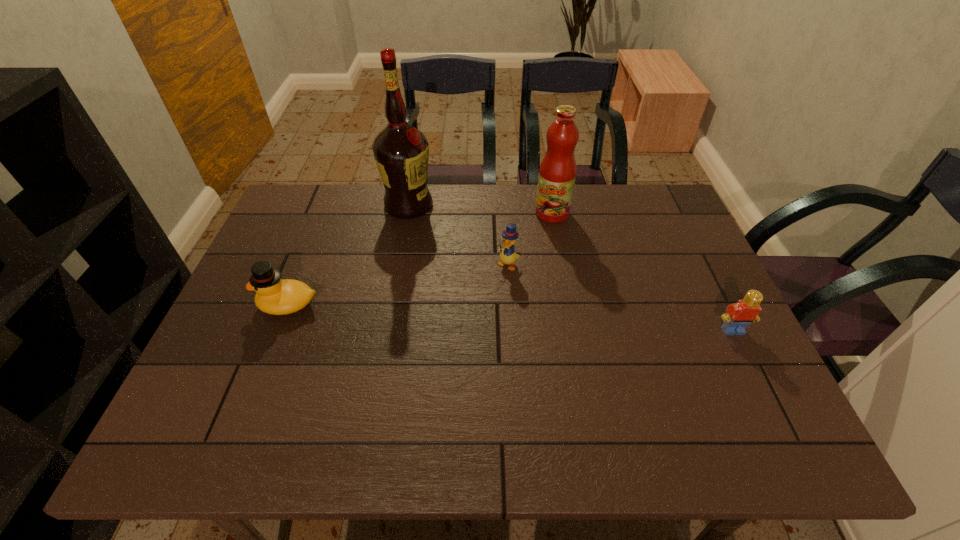
Locate an element on the screen. The width and height of the screenshot is (960, 540). the leftmost object is located at coordinates pyautogui.click(x=274, y=296).

The image size is (960, 540). I want to click on duck, so click(x=274, y=296).

Where is `the rightmost object`? The height and width of the screenshot is (540, 960). the rightmost object is located at coordinates (738, 316).

In order to click on the nearest object in this screenshot , I will do `click(738, 316)`.

At what (x,y) coordinates should I click in order to perform the action: click on alcohol. Please return your answer as a coordinate pair (x, y). The height and width of the screenshot is (540, 960). Looking at the image, I should click on (401, 152).

At what (x,y) coordinates should I click in order to perform the action: click on the fourth object from right to left. Please return your answer as a coordinate pair (x, y). This screenshot has height=540, width=960. Looking at the image, I should click on (401, 152).

Locate an element on the screen. The image size is (960, 540). the second tallest object is located at coordinates (557, 173).

Find the location of a particular element. the fourth object from left to right is located at coordinates point(557,173).

Locate an element on the screen. This screenshot has height=540, width=960. duckling is located at coordinates (507, 256).

Where is `the third object from right to left`? This screenshot has width=960, height=540. the third object from right to left is located at coordinates click(x=507, y=256).